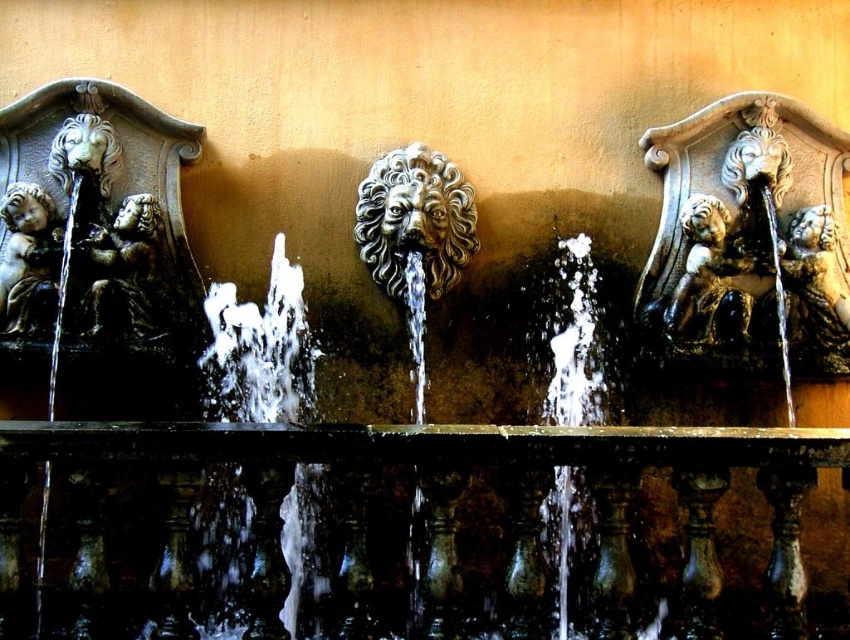
Question: Does clear water at center have a greater width compared to bronze statue at left?

Choices:
 (A) no
 (B) yes

Answer: (A)

Question: Which object is closer to the camera taking this photo?

Choices:
 (A) bronze cherub at left
 (B) bronze cherub at right
 (C) clear water at center
 (D) polished bronze lion head at center

Answer: (A)

Question: Does bronze cherub at center appear on the left side of bronze cherub at left?

Choices:
 (A) no
 (B) yes

Answer: (A)

Question: Does bronze cherub at center have a larger size compared to bronze cherub at left?

Choices:
 (A) no
 (B) yes

Answer: (B)

Question: Among these objects, which one is farthest from the camera?

Choices:
 (A) clear water at center
 (B) polished bronze lion head at center

Answer: (A)

Question: Which object is the closest to the polished bronze lion head at center?

Choices:
 (A) bronze statue at left
 (B) bronze balustrade at center
 (C) clear water at center
 (D) bronze cherub at left

Answer: (C)